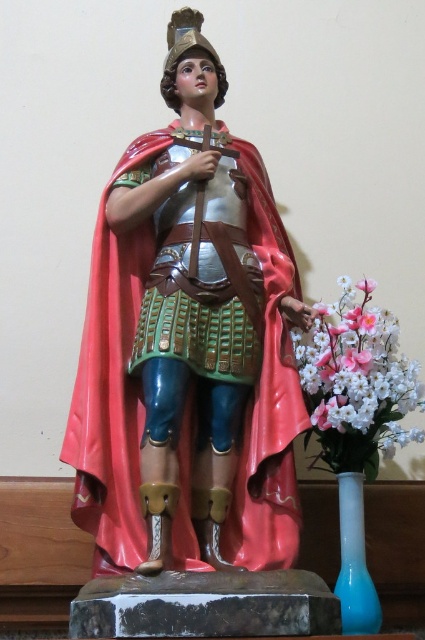
Does shiny plastic statue at center have a larger size compared to blue glass vase at lower right?

Correct, shiny plastic statue at center is larger in size than blue glass vase at lower right.

What do you see at coordinates (189, 346) in the screenshot? This screenshot has width=425, height=640. I see `shiny plastic statue at center` at bounding box center [189, 346].

Locate an element on the screen. The width and height of the screenshot is (425, 640). shiny plastic statue at center is located at coordinates 189,346.

Locate an element on the screen. shiny plastic statue at center is located at coordinates (189, 346).

Does shiny plastic statue at center have a lesser height compared to white silk flowers at right?

No.

Which is in front, point (132, 252) or point (350, 305)?

Positioned in front is point (132, 252).

In order to click on shiny plastic statue at center in this screenshot , I will do `click(189, 346)`.

Does white silk flowers at right appear on the left side of blue glass vase at lower right?

No, white silk flowers at right is not to the left of blue glass vase at lower right.

Is point (337, 408) farther from viewer compared to point (357, 573)?

That is True.

Find the location of a particular element. white silk flowers at right is located at coordinates (357, 381).